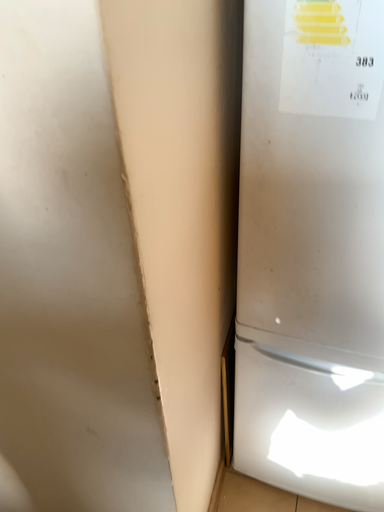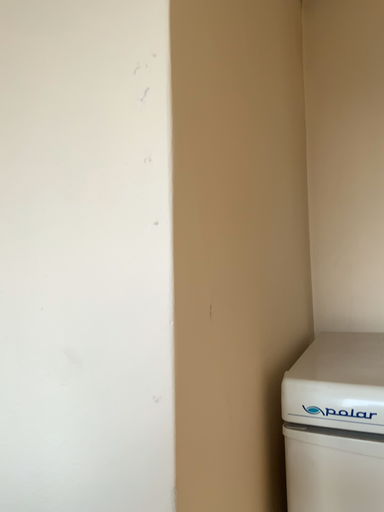
Question: How did the camera likely rotate when shooting the video?

Choices:
 (A) rotated upward
 (B) rotated downward

Answer: (A)